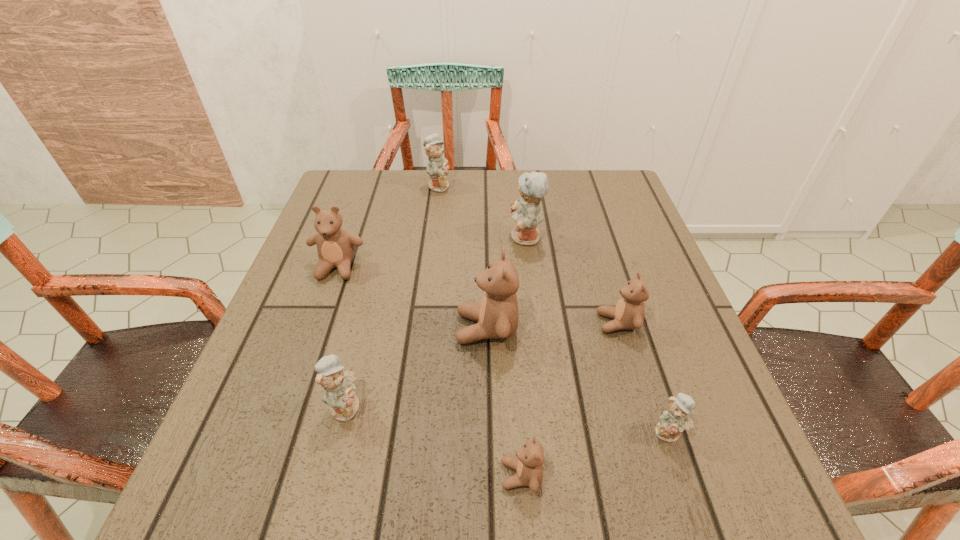
I want to click on free space that is in between the third farthest object and the nearest teddy bear, so click(429, 371).

In order to click on vacant area between the biggest brown teddy bear and the nearest object in this screenshot , I will do `click(504, 402)`.

Locate an element on the screen. The image size is (960, 540). vacant area that lies between the seventh teddy bear from right to left and the nearest teddy bear is located at coordinates coord(433,440).

Locate an element on the screen. The image size is (960, 540). vacant area that lies between the rightmost blue teddy bear and the second smallest brown teddy bear is located at coordinates (643, 377).

You are a GUI agent. You are given a task and a screenshot of the screen. Output one action in this format:
    pyautogui.click(x=<x>, y=<y>)
    Task: Click on the vacant region between the farthest brown teddy bear and the farthest blue teddy bear
    
    Given the screenshot: What is the action you would take?
    pyautogui.click(x=388, y=226)

Where is `vacant space that's between the third blue teddy bear from left to right and the third biggest brown teddy bear`? The image size is (960, 540). vacant space that's between the third blue teddy bear from left to right and the third biggest brown teddy bear is located at coordinates (572, 280).

Image resolution: width=960 pixels, height=540 pixels. Identify the location of free space between the second smallest brown teddy bear and the third farthest object. (478, 295).

I want to click on vacant area that lies between the biggest brown teddy bear and the third farthest teddy bear, so click(412, 298).

Locate which object ranks seventh in proximity to the leftmost teddy bear. Please provide its 2D coordinates. Your answer should be formatted as a tuple, i.e. [(x, y)], where the tuple contains the x and y coordinates of a point satisfying the conditions above.

[(675, 420)]

You are a GUI agent. You are given a task and a screenshot of the screen. Output one action in this format:
    pyautogui.click(x=<x>, y=<y>)
    Task: Click on the fourth closest object to the smallest blue teddy bear
    This screenshot has height=540, width=960.
    Given the screenshot: What is the action you would take?
    pyautogui.click(x=526, y=211)